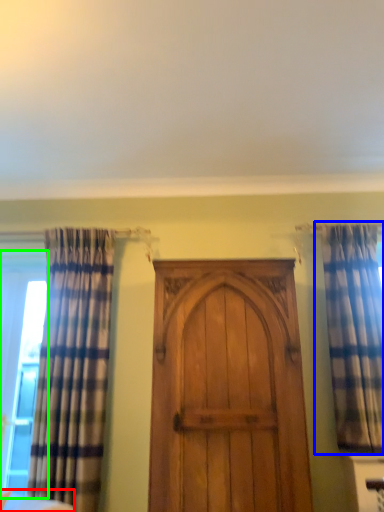
Question: Considering the real-world distances, which object is closest to furniture (highlighted by a red box)? curtain (highlighted by a blue box) or window (highlighted by a green box).

Choices:
 (A) curtain
 (B) window

Answer: (B)